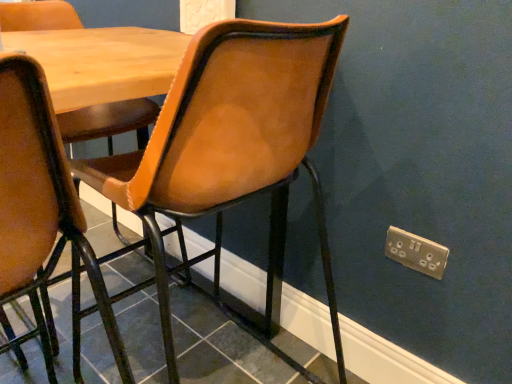
Image resolution: width=512 pixels, height=384 pixels. I want to click on free area below leather-like brown chair at center (from a real-world perspective), so click(118, 315).